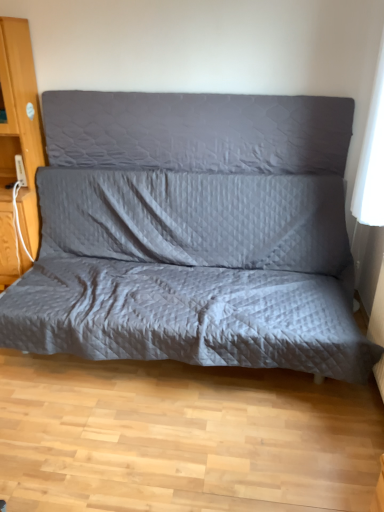
Question: Is quilted gray studio couch at center inside the boundaries of gray quilted pillow at center, or outside?

Choices:
 (A) inside
 (B) outside

Answer: (B)

Question: Is quilted gray studio couch at center wider or thinner than gray quilted pillow at center?

Choices:
 (A) thin
 (B) wide

Answer: (B)

Question: Based on their relative distances, which object is farther from the quilted gray studio couch at center?

Choices:
 (A) gray quilted pillow at center
 (B) wooden dresser at left

Answer: (B)

Question: Estimate the real-world distances between objects in this image. Which object is closer to the wooden dresser at left?

Choices:
 (A) gray quilted pillow at center
 (B) quilted gray studio couch at center

Answer: (A)